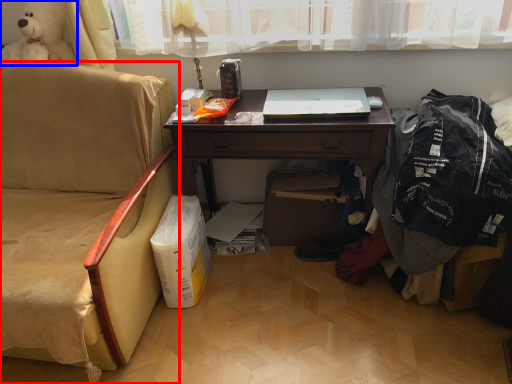
Question: Which object appears farthest to the camera in this image, chair (highlighted by a red box) or toy (highlighted by a blue box)?

Choices:
 (A) chair
 (B) toy

Answer: (B)